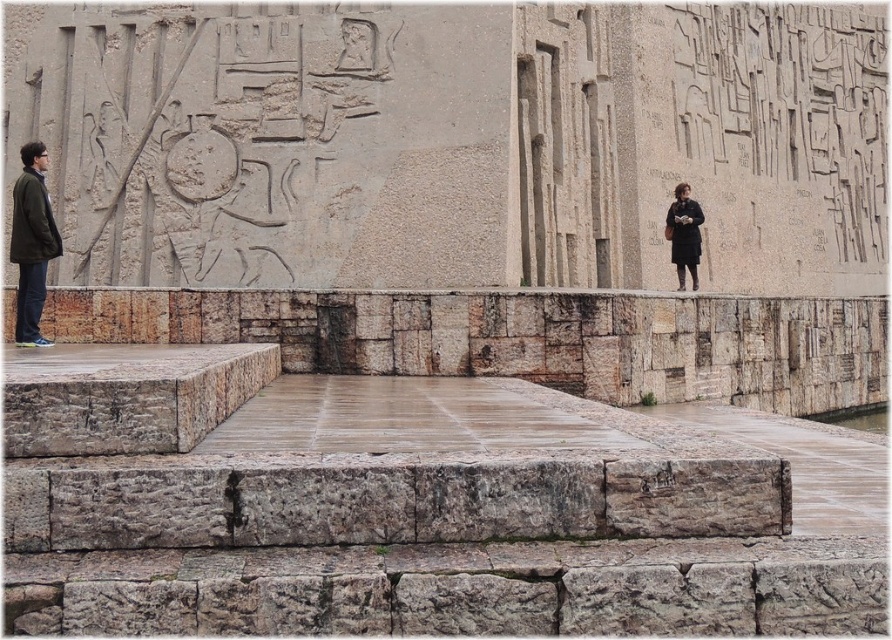
Which is in front, point (34, 308) or point (687, 236)?

Point (34, 308) is more forward.

Consider the image. Does green matte jacket at left have a smaller size compared to black matte coat at right?

No.

Is point (30, 307) closer to camera compared to point (694, 260)?

Yes, point (30, 307) is closer to viewer.

Where is `green matte jacket at left`? This screenshot has height=640, width=892. green matte jacket at left is located at coordinates (32, 243).